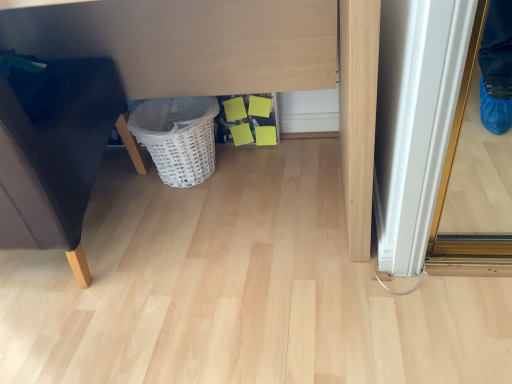
Identify the location of free spot to the left of white wicker basket at lower center. The height and width of the screenshot is (384, 512). (120, 185).